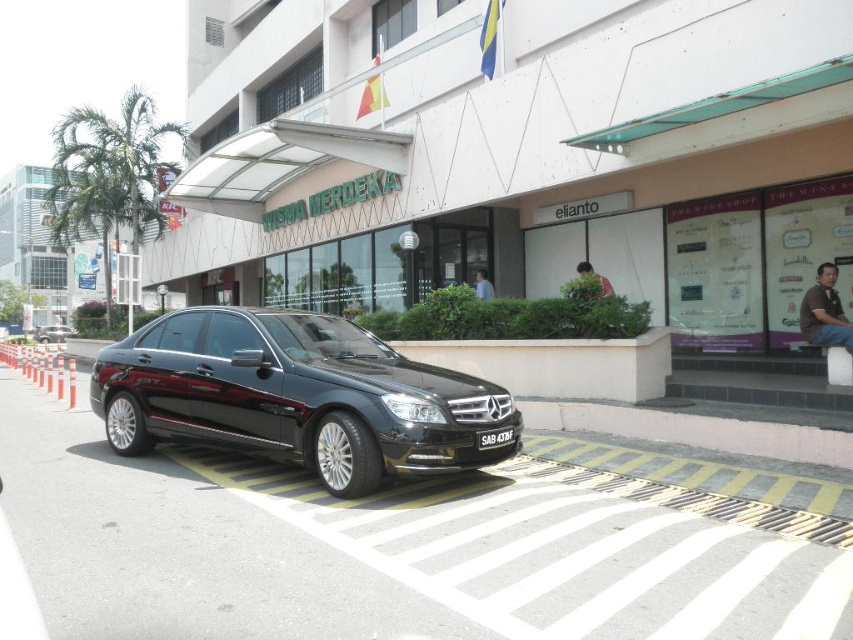
Between point (489, 444) and point (476, 288), which one is positioned behind?

Point (476, 288)

Which is more to the left, black plastic license plate at center or dark brown leather jacket at center?

Positioned to the left is black plastic license plate at center.

Is point (488, 432) positioned before point (488, 289)?

That is True.

I want to click on black plastic license plate at center, so [495, 438].

Between point (347, 355) and point (492, 435), which one is positioned behind?

Point (347, 355)

Does point (392, 438) come closer to viewer compared to point (503, 440)?

Yes, point (392, 438) is in front of point (503, 440).

Measure the distance between point (193, 400) and camera.

The distance of point (193, 400) from camera is 7.18 meters.

Image resolution: width=853 pixels, height=640 pixels. I want to click on black metallic car at center, so click(294, 396).

Between brown leather shirt at right and black plastic license plate at center, which one appears on the right side from the viewer's perspective?

brown leather shirt at right

Does brown leather shirt at right have a smaller size compared to black plastic license plate at center?

Actually, brown leather shirt at right might be larger than black plastic license plate at center.

The width and height of the screenshot is (853, 640). Identify the location of brown leather shirt at right. (824, 310).